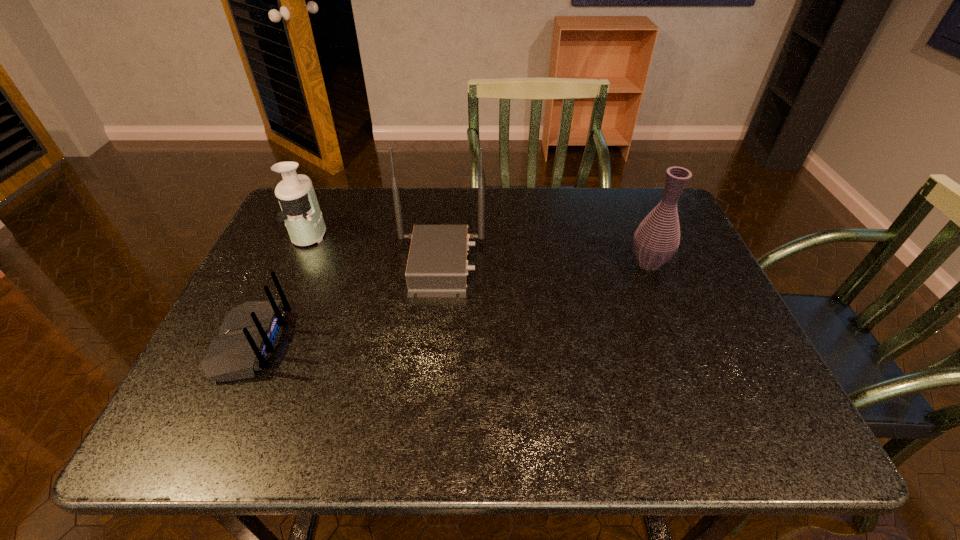
Where is `free space between the rightmost object and the right router`? The height and width of the screenshot is (540, 960). free space between the rightmost object and the right router is located at coordinates (544, 264).

Identify the location of vacant area that lies between the second object from right to left and the rightmost object. The height and width of the screenshot is (540, 960). (544, 264).

The image size is (960, 540). In order to click on free space between the shorter router and the vase in this screenshot , I will do `click(449, 303)`.

Find the location of a particular element. This screenshot has width=960, height=540. vacant area between the right router and the vase is located at coordinates (544, 264).

The width and height of the screenshot is (960, 540). Find the location of `empty space between the vase and the third tallest object`. empty space between the vase and the third tallest object is located at coordinates (479, 248).

Locate an element on the screen. This screenshot has height=540, width=960. vacant space that's between the vase and the nearest object is located at coordinates (449, 303).

The width and height of the screenshot is (960, 540). What are the coordinates of `vacant region between the left router and the right router` in the screenshot? It's located at (346, 303).

Identify the location of free area in between the left router and the farther router. This screenshot has height=540, width=960. (346, 303).

The width and height of the screenshot is (960, 540). In order to click on object identified as the closest to the right router in this screenshot , I will do `click(301, 213)`.

Identify which object is the third closest to the third tallest object. Please provide its 2D coordinates. Your answer should be formatted as a tuple, i.e. [(x, y)], where the tuple contains the x and y coordinates of a point satisfying the conditions above.

[(656, 240)]